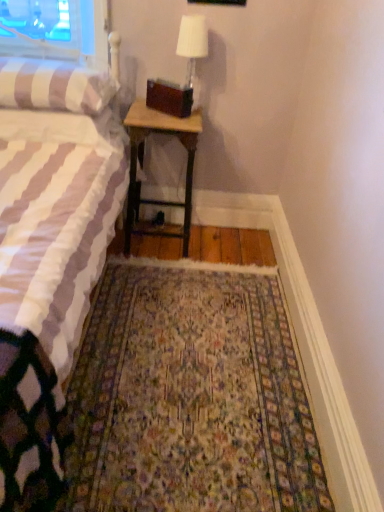
Question: Is point (74, 87) closer or farther from the camera than point (228, 388)?

Choices:
 (A) farther
 (B) closer

Answer: (A)

Question: From the image's perspective, is striped fabric pillow at left located above or below floral carpet at center?

Choices:
 (A) above
 (B) below

Answer: (A)

Question: Which of these objects is positioned farthest from the wooden nightstand at center?

Choices:
 (A) white fabric lampshade at upper center
 (B) white striped fabric bed at left
 (C) striped fabric pillow at left
 (D) floral carpet at center

Answer: (D)

Question: Which of these objects is positioned farthest from the floral carpet at center?

Choices:
 (A) striped fabric pillow at left
 (B) wooden nightstand at center
 (C) white striped fabric bed at left
 (D) white fabric lampshade at upper center

Answer: (D)